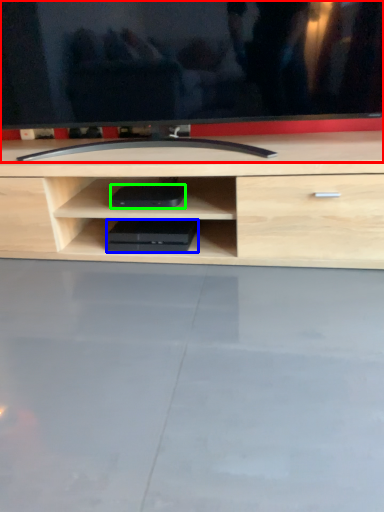
Question: Which object is positioned closest to television (highlighted by a red box)? Select from equipment (highlighted by a blue box) and equipment (highlighted by a green box).

Choices:
 (A) equipment
 (B) equipment

Answer: (B)